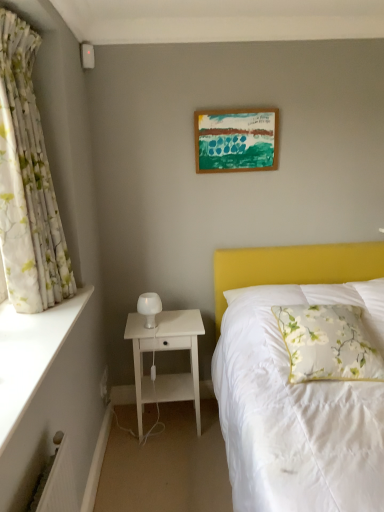
You are a GUI agent. You are given a task and a screenshot of the screen. Output one action in this format:
    pyautogui.click(x=<x>, y=<y>)
    Task: Click on the spots to the right of white frosted glass table lamp at left
    
    Given the screenshot: What is the action you would take?
    pyautogui.click(x=183, y=322)